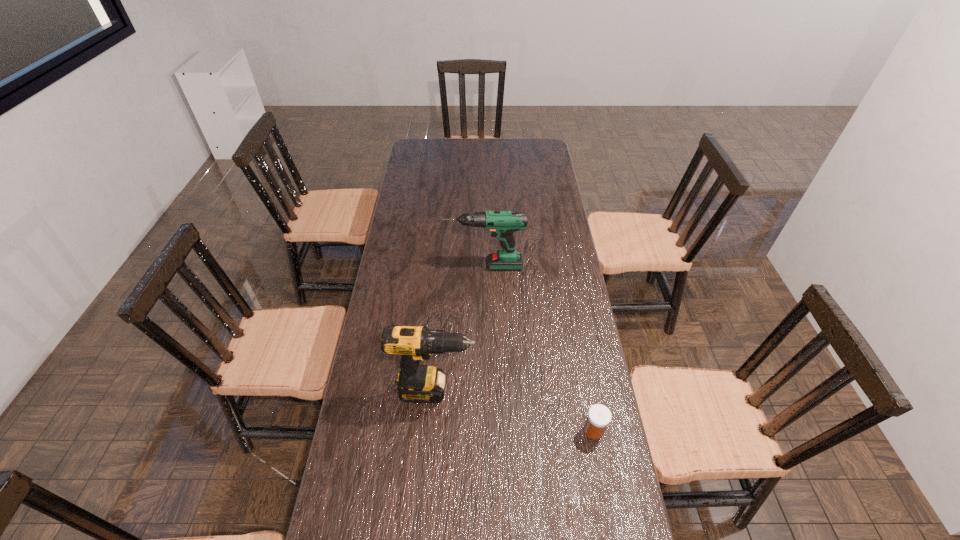
What are the coordinates of `vacant point that satisfies the following two spatial constraints: 1. on the handle side of the farther drill; 2. on the left side of the medicine` in the screenshot? It's located at (486, 431).

I want to click on vacant space that satisfies the following two spatial constraints: 1. at the tip of the rightmost object; 2. on the right side of the nearer drill, so click(432, 431).